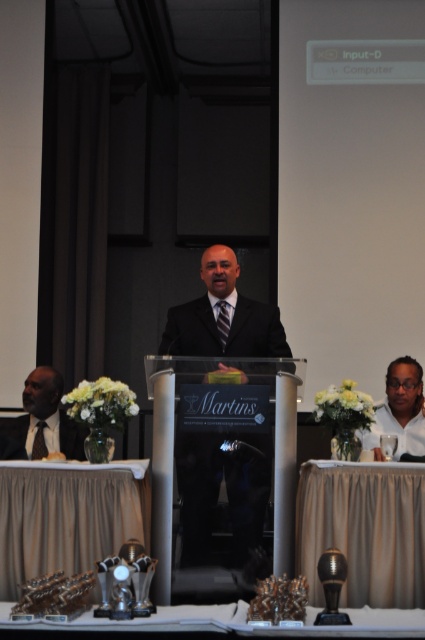
Question: Is beige fabric table at lower center in front of silky beige tablecloth at lower left?

Choices:
 (A) no
 (B) yes

Answer: (B)

Question: Which of the following is the closest to the observer?

Choices:
 (A) (410, 404)
 (B) (422, 586)
 (C) (30, 378)
 (D) (39, 497)

Answer: (B)

Question: Which object is closer to the camera taking this photo?

Choices:
 (A) matte black suit at left
 (B) matte black suit at lower right
 (C) matte black suit at center
 (D) metallic trophies at lower center

Answer: (D)

Question: Estimate the real-world distances between objects in this image. Which object is farther from the matte black suit at left?

Choices:
 (A) metallic trophies at lower center
 (B) beige fabric table at lower center

Answer: (A)

Question: Is beige fabric table at lower center bigger than matte black suit at lower right?

Choices:
 (A) no
 (B) yes

Answer: (A)

Question: Can you confirm if beige fabric table at lower center is positioned below metallic trophies at lower center?

Choices:
 (A) yes
 (B) no

Answer: (B)